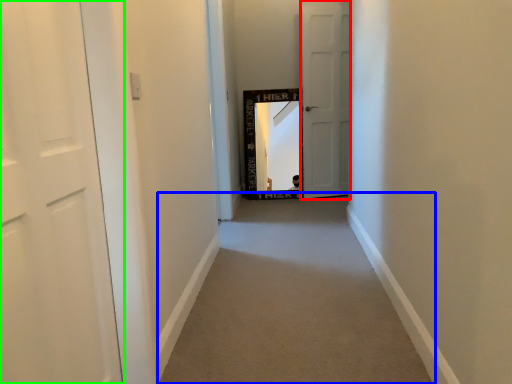
Question: Estimate the real-world distances between objects in this image. Which object is closer to door (highlighted by a red box), alley (highlighted by a blue box) or door (highlighted by a green box)?

Choices:
 (A) alley
 (B) door

Answer: (A)